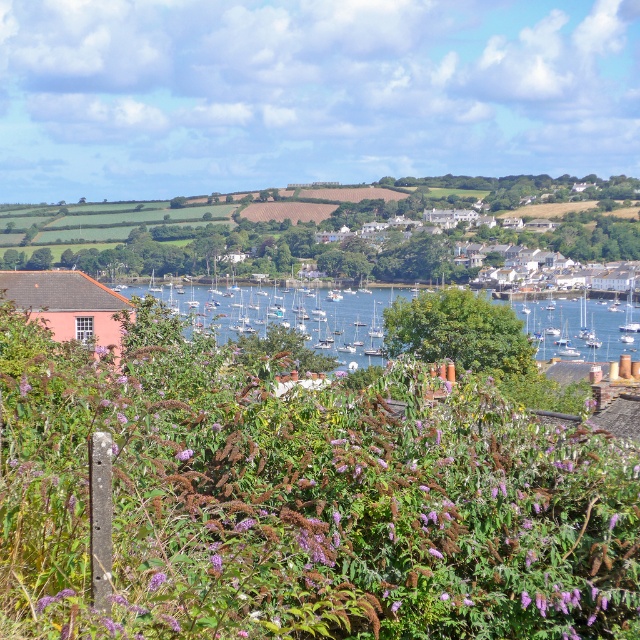
Is point (168, 342) positioned behind point (358, 300)?

No, it is in front of (358, 300).

Between point (461, 387) and point (547, 308), which one is positioned in front?

Positioned in front is point (461, 387).

Is point (476, 452) closer to viewer compared to point (308, 304)?

Yes, it is in front of point (308, 304).

I want to click on purple fuzzy bush at center, so click(301, 500).

Who is more forward, (16, 362) or (634, 332)?

Point (16, 362) is more forward.

The height and width of the screenshot is (640, 640). Identify the location of purple fuzzy bush at center. (301, 500).

Is blue water at center thinner than white glossy sailboat at center?

Incorrect, blue water at center's width is not less than white glossy sailboat at center's.

In the scene shown: Is blue water at center smaller than white glossy sailboat at center?

Actually, blue water at center might be larger than white glossy sailboat at center.

Is point (531, 321) in front of point (632, 312)?

Yes, it is in front of point (632, 312).

Where is `blue water at center`? This screenshot has height=640, width=640. blue water at center is located at coordinates (573, 328).